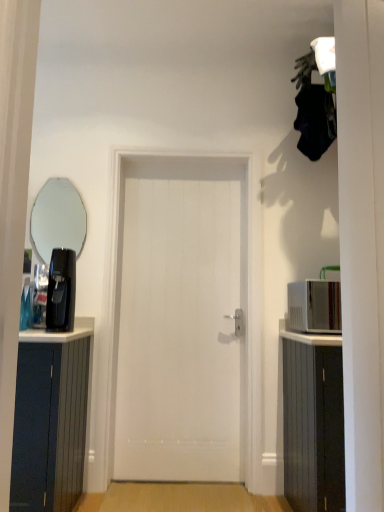
What is the approximate width of clear glass mirror at upper left?

The width of clear glass mirror at upper left is 1.48 inches.

What is the approximate height of white glossy microwave at right?

white glossy microwave at right is 11.39 inches tall.

What do you see at coordinates (315, 306) in the screenshot?
I see `white glossy microwave at right` at bounding box center [315, 306].

What do you see at coordinates (61, 291) in the screenshot?
I see `black plastic coffee machine at left` at bounding box center [61, 291].

The width and height of the screenshot is (384, 512). What are the coordinates of `clear glass mirror at upper left` in the screenshot? It's located at (58, 218).

How many degrees apart are the facing directions of clear glass mirror at upper left and white wood cabinet at right?

clear glass mirror at upper left and white wood cabinet at right are facing 0.63 degrees away from each other.

Is clear glass mirror at upper left next to white wood cabinet at right?

No, clear glass mirror at upper left is not in contact with white wood cabinet at right.

Between point (42, 227) and point (300, 454), which one is positioned in front?

Positioned in front is point (300, 454).

Choose the correct answer: Is black plastic coffee machine at left inside white wood cabinet at right or outside it?

black plastic coffee machine at left is spatially situated outside white wood cabinet at right.

From the image's perspective, is black plastic coffee machine at left over white wood cabinet at right?

Yes, from the image's perspective, black plastic coffee machine at left is above white wood cabinet at right.

From a real-world perspective, is black plastic coffee machine at left below white wood cabinet at right?

Actually, black plastic coffee machine at left is physically above white wood cabinet at right in the real world.

Considering the positions of objects black plastic coffee machine at left and white wood cabinet at right in the image provided, who is more to the left, black plastic coffee machine at left or white wood cabinet at right?

Positioned to the left is black plastic coffee machine at left.

Identify the location of cabinetry located in front of the white glossy microwave at right. This screenshot has height=512, width=384. (313, 422).

Is white glossy microwave at right next to white wood cabinet at right?

white glossy microwave at right and white wood cabinet at right are not in contact.

Does white glossy microwave at right lie in front of white wood cabinet at right?

No, white glossy microwave at right is behind white wood cabinet at right.

Could you tell me if white glossy microwave at right is facing white wood cabinet at right?

No.

Considering the positions of objects white wood cabinet at right and clear glass mirror at upper left in the image provided, who is more to the left, white wood cabinet at right or clear glass mirror at upper left?

From the viewer's perspective, clear glass mirror at upper left appears more on the left side.

Is white wood cabinet at right looking in the opposite direction of clear glass mirror at upper left?

No.

Considering the points (342, 484) and (49, 246), which point is behind, point (342, 484) or point (49, 246)?

The point (49, 246) is farther.

Considering the relative positions of white wood cabinet at right and clear glass mirror at upper left in the image provided, is white wood cabinet at right behind clear glass mirror at upper left?

No, it is in front of clear glass mirror at upper left.

Which is more to the right, black plastic coffee machine at left or white smooth door at center?

white smooth door at center.

Which object is thinner, black plastic coffee machine at left or white smooth door at center?

With smaller width is white smooth door at center.

From a real-world perspective, is black plastic coffee machine at left physically located above or below white smooth door at center?

From a real-world perspective, black plastic coffee machine at left is physically above white smooth door at center.

Is black plastic coffee machine at left bigger than white smooth door at center?

No, black plastic coffee machine at left is not bigger than white smooth door at center.

From a real-world perspective, is white smooth door at center physically located above or below white wood cabinet at right?

Clearly, from a real-world perspective, white smooth door at center is above white wood cabinet at right.

Is white smooth door at center wider or thinner than white wood cabinet at right?

Considering their sizes, white smooth door at center looks slimmer than white wood cabinet at right.

Could white wood cabinet at right be considered to be inside white smooth door at center?

Actually, white wood cabinet at right is outside white smooth door at center.

Which is farther, (171,383) or (313,472)?

The point (171,383) is more distant.

Can we say clear glass mirror at upper left lies outside black plastic coffee machine at left?

Absolutely, clear glass mirror at upper left is external to black plastic coffee machine at left.

Is clear glass mirror at upper left with black plastic coffee machine at left?

No.

Can you confirm if clear glass mirror at upper left is taller than black plastic coffee machine at left?

Correct, clear glass mirror at upper left is much taller as black plastic coffee machine at left.

The image size is (384, 512). In order to click on cabinetry on the right of the clear glass mirror at upper left in this screenshot , I will do `click(313, 422)`.

Locate an element on the screen. This screenshot has height=512, width=384. cabinetry beneath the black plastic coffee machine at left (from a real-world perspective) is located at coordinates (313, 422).

When comparing their distances from clear glass mirror at upper left, does white wood cabinet at right or black plastic coffee machine at left seem closer?

The object closer to clear glass mirror at upper left is black plastic coffee machine at left.

Which object lies nearer to the anchor point white smooth door at center, white wood cabinet at right or white glossy microwave at right?

Among the two, white wood cabinet at right is located nearer to white smooth door at center.

Which object lies further to the anchor point white wood cabinet at right, white smooth door at center or clear glass mirror at upper left?

clear glass mirror at upper left.

Looking at the image, which one is located further to clear glass mirror at upper left, white glossy microwave at right or white smooth door at center?

white glossy microwave at right.

Based on their spatial positions, is white smooth door at center or black plastic coffee machine at left further from clear glass mirror at upper left?

Based on the image, white smooth door at center appears to be further to clear glass mirror at upper left.

Considering their positions, is clear glass mirror at upper left positioned further to black plastic coffee machine at left than white smooth door at center?

clear glass mirror at upper left lies further to black plastic coffee machine at left than the other object.

Based on their spatial positions, is white smooth door at center or white glossy microwave at right further from clear glass mirror at upper left?

white glossy microwave at right is positioned further to the anchor clear glass mirror at upper left.

Which object lies nearer to the anchor point white smooth door at center, clear glass mirror at upper left or black plastic coffee machine at left?

black plastic coffee machine at left is closer to white smooth door at center.

Locate an element on the screen. cabinetry located between white smooth door at center and white glossy microwave at right in the left-right direction is located at coordinates (313, 422).

At what (x,y) coordinates should I click in order to perform the action: click on coffee machine between clear glass mirror at upper left and white glossy microwave at right. Please return your answer as a coordinate pair (x, y). The width and height of the screenshot is (384, 512). Looking at the image, I should click on (61, 291).

This screenshot has width=384, height=512. I want to click on door situated between clear glass mirror at upper left and white wood cabinet at right from left to right, so click(180, 320).

At what (x,y) coordinates should I click in order to perform the action: click on door between black plastic coffee machine at left and white wood cabinet at right in the horizontal direction. Please return your answer as a coordinate pair (x, y). The height and width of the screenshot is (512, 384). Looking at the image, I should click on (180, 320).